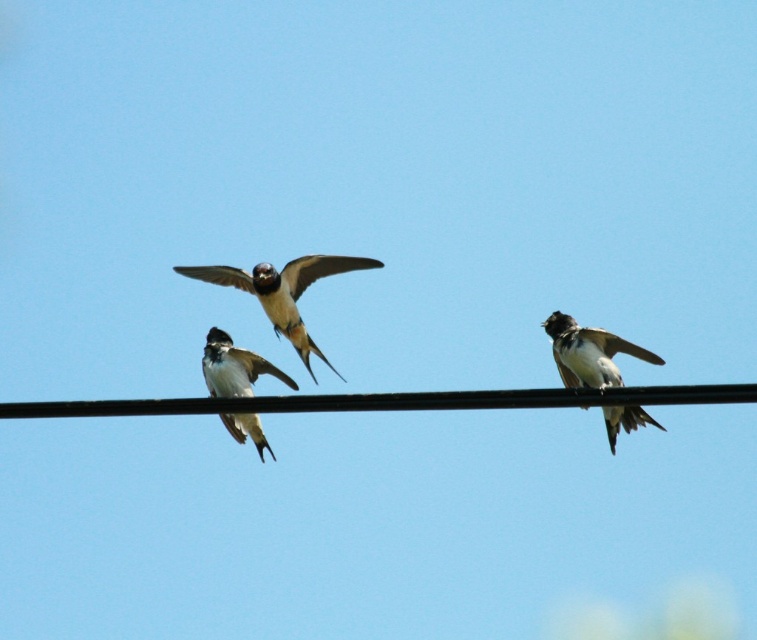
Between black wire at center and brown speckled feathers at center, which one appears on the right side from the viewer's perspective?

black wire at center

Is point (357, 404) positioned before point (251, 285)?

Yes, point (357, 404) is in front of point (251, 285).

The image size is (757, 640). Identify the location of black wire at center. (391, 401).

Which is in front, point (269, 291) or point (232, 369)?

Point (232, 369) is in front.

Which of these two, brown speckled feathers at center or black and white feathers at center, stands shorter?

With less height is black and white feathers at center.

The height and width of the screenshot is (640, 757). Identify the location of brown speckled feathers at center. coord(282,291).

How far apart are white-feathered bird at center and black and white feathers at center?

white-feathered bird at center and black and white feathers at center are 6.14 feet apart.

Is point (575, 342) farther from viewer compared to point (209, 337)?

No, it is in front of (209, 337).

This screenshot has height=640, width=757. I want to click on white-feathered bird at center, so click(587, 353).